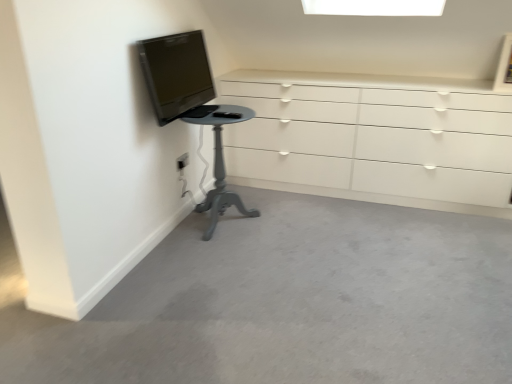
What do you see at coordinates (374, 139) in the screenshot?
I see `white glossy chest of drawers at upper right` at bounding box center [374, 139].

In order to click on matte gray pedestal table at lower left in this screenshot , I will do `click(219, 160)`.

This screenshot has width=512, height=384. What do you see at coordinates (176, 74) in the screenshot?
I see `matte black tv at upper left` at bounding box center [176, 74].

Locate an element on the screen. This screenshot has height=384, width=512. white glossy chest of drawers at upper right is located at coordinates (374, 139).

What's the angular difference between matte black tv at upper left and white plastic electric outlet at lower left's facing directions?

The angle between the facing direction of matte black tv at upper left and the facing direction of white plastic electric outlet at lower left is 0.42 degrees.

Could you tell me if matte black tv at upper left is facing white plastic electric outlet at lower left?

No, matte black tv at upper left does not turn towards white plastic electric outlet at lower left.

Is white plastic electric outlet at lower left located within matte black tv at upper left?

Definitely not — white plastic electric outlet at lower left is not inside matte black tv at upper left.

Can you see matte black tv at upper left touching white plastic electric outlet at lower left?

matte black tv at upper left and white plastic electric outlet at lower left are clearly separated.

Consider the image. From the image's perspective, which object appears higher, matte black tv at upper left or matte gray pedestal table at lower left?

matte black tv at upper left, from the image's perspective.

From a real-world perspective, who is located higher, matte black tv at upper left or matte gray pedestal table at lower left?

matte black tv at upper left.

Who is more distant, matte black tv at upper left or matte gray pedestal table at lower left?

matte gray pedestal table at lower left is further from the camera.

Considering the sizes of matte black tv at upper left and matte gray pedestal table at lower left in the image, is matte black tv at upper left bigger or smaller than matte gray pedestal table at lower left?

matte black tv at upper left is smaller than matte gray pedestal table at lower left.

From the image's perspective, is white glossy chest of drawers at upper right located above matte gray pedestal table at lower left?

Correct, white glossy chest of drawers at upper right appears higher than matte gray pedestal table at lower left in the image.

Is white glossy chest of drawers at upper right not close to matte gray pedestal table at lower left?

Actually, white glossy chest of drawers at upper right and matte gray pedestal table at lower left are a little close together.

Is white glossy chest of drawers at upper right surrounding matte gray pedestal table at lower left?

Actually, matte gray pedestal table at lower left is outside white glossy chest of drawers at upper right.

Between white glossy chest of drawers at upper right and matte gray pedestal table at lower left, which one has more height?

white glossy chest of drawers at upper right.

Is matte gray pedestal table at lower left not close to white glossy chest of drawers at upper right?

matte gray pedestal table at lower left is near white glossy chest of drawers at upper right, not far away.

From a real-world perspective, is matte gray pedestal table at lower left under white glossy chest of drawers at upper right?

A: Yes, from a real-world perspective, matte gray pedestal table at lower left is below white glossy chest of drawers at upper right.

Does matte gray pedestal table at lower left have a greater height compared to white glossy chest of drawers at upper right?

Incorrect, the height of matte gray pedestal table at lower left is not larger of that of white glossy chest of drawers at upper right.

From the picture: Could you tell me if matte gray pedestal table at lower left is facing white glossy chest of drawers at upper right?

No, matte gray pedestal table at lower left is not facing towards white glossy chest of drawers at upper right.

Are matte black tv at upper left and white glossy chest of drawers at upper right making contact?

They are not placed beside each other.

Is matte black tv at upper left oriented away from white glossy chest of drawers at upper right?

No, matte black tv at upper left is not facing away from white glossy chest of drawers at upper right.

Which is correct: matte black tv at upper left is inside white glossy chest of drawers at upper right, or outside of it?

matte black tv at upper left is not enclosed by white glossy chest of drawers at upper right.

Based on the photo, how many degrees apart are the facing directions of matte black tv at upper left and white glossy chest of drawers at upper right?

The angular difference between matte black tv at upper left and white glossy chest of drawers at upper right is 89.9 degrees.

From a real-world perspective, between white plastic electric outlet at lower left and white glossy chest of drawers at upper right, who is vertically higher?

white glossy chest of drawers at upper right.

Does point (179, 163) lie behind point (485, 172)?

No, it is not.

Would you say white plastic electric outlet at lower left is inside or outside white glossy chest of drawers at upper right?

The correct answer is: outside.

Consider the image. Is white plastic electric outlet at lower left at the right side of white glossy chest of drawers at upper right?

No.

Which of these two, matte gray pedestal table at lower left or matte black tv at upper left, is wider?

Wider between the two is matte gray pedestal table at lower left.

In the scene shown: Is matte gray pedestal table at lower left facing towards matte black tv at upper left?

No, matte gray pedestal table at lower left does not turn towards matte black tv at upper left.

Can you tell me how much matte gray pedestal table at lower left and matte black tv at upper left differ in facing direction?

0.118 degrees.

Looking at this image, from the image's perspective, is matte gray pedestal table at lower left above or below matte black tv at upper left?

matte gray pedestal table at lower left is situated lower than matte black tv at upper left in the image.

Locate an element on the screen. The width and height of the screenshot is (512, 384). television on the right of the white plastic electric outlet at lower left is located at coordinates (176, 74).

The height and width of the screenshot is (384, 512). I want to click on television above the matte gray pedestal table at lower left (from the image's perspective), so click(176, 74).

Which object lies nearer to the anchor point matte black tv at upper left, white glossy chest of drawers at upper right or matte gray pedestal table at lower left?

Based on the image, matte gray pedestal table at lower left appears to be nearer to matte black tv at upper left.

Based on their spatial positions, is matte black tv at upper left or white plastic electric outlet at lower left closer to white glossy chest of drawers at upper right?

Among the two, matte black tv at upper left is located nearer to white glossy chest of drawers at upper right.

Looking at the image, which one is located closer to matte black tv at upper left, white plastic electric outlet at lower left or white glossy chest of drawers at upper right?

Among the two, white plastic electric outlet at lower left is located nearer to matte black tv at upper left.

When comparing their distances from matte gray pedestal table at lower left, does matte black tv at upper left or white plastic electric outlet at lower left seem closer?

white plastic electric outlet at lower left.

Based on their spatial positions, is white plastic electric outlet at lower left or matte black tv at upper left further from matte gray pedestal table at lower left?

Among the two, matte black tv at upper left is located further to matte gray pedestal table at lower left.

From the image, which object appears to be farther from white glossy chest of drawers at upper right, matte gray pedestal table at lower left or white plastic electric outlet at lower left?

white plastic electric outlet at lower left.

Considering their positions, is white glossy chest of drawers at upper right positioned further to matte gray pedestal table at lower left than matte black tv at upper left?

white glossy chest of drawers at upper right lies further to matte gray pedestal table at lower left than the other object.

Estimate the real-world distances between objects in this image. Which object is further from matte black tv at upper left, matte gray pedestal table at lower left or white glossy chest of drawers at upper right?

white glossy chest of drawers at upper right.

You are a GUI agent. You are given a task and a screenshot of the screen. Output one action in this format:
    pyautogui.click(x=<x>, y=<y>)
    Task: Click on the television between white plastic electric outlet at lower left and white glossy chest of drawers at upper right from left to right
    The image size is (512, 384).
    Given the screenshot: What is the action you would take?
    pyautogui.click(x=176, y=74)

Where is `furniture positioned between matte black tv at upper left and white plastic electric outlet at lower left from near to far`? The width and height of the screenshot is (512, 384). furniture positioned between matte black tv at upper left and white plastic electric outlet at lower left from near to far is located at coordinates (219, 160).

This screenshot has height=384, width=512. I want to click on furniture between matte black tv at upper left and white glossy chest of drawers at upper right from left to right, so click(219, 160).

Locate an element on the screen. furniture located between white plastic electric outlet at lower left and white glossy chest of drawers at upper right in the left-right direction is located at coordinates (219, 160).